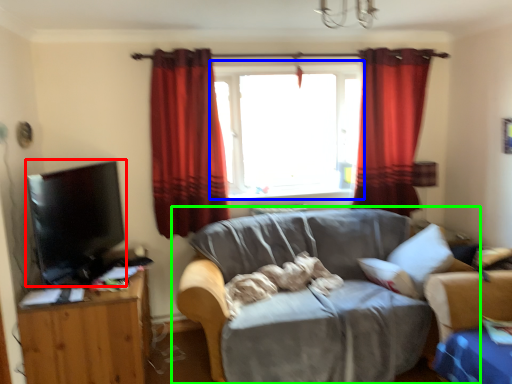
Question: Which object is the farthest from flat (highlighted by a red box)? Choose among these: window (highlighted by a blue box) or studio couch (highlighted by a green box).

Choices:
 (A) window
 (B) studio couch

Answer: (A)